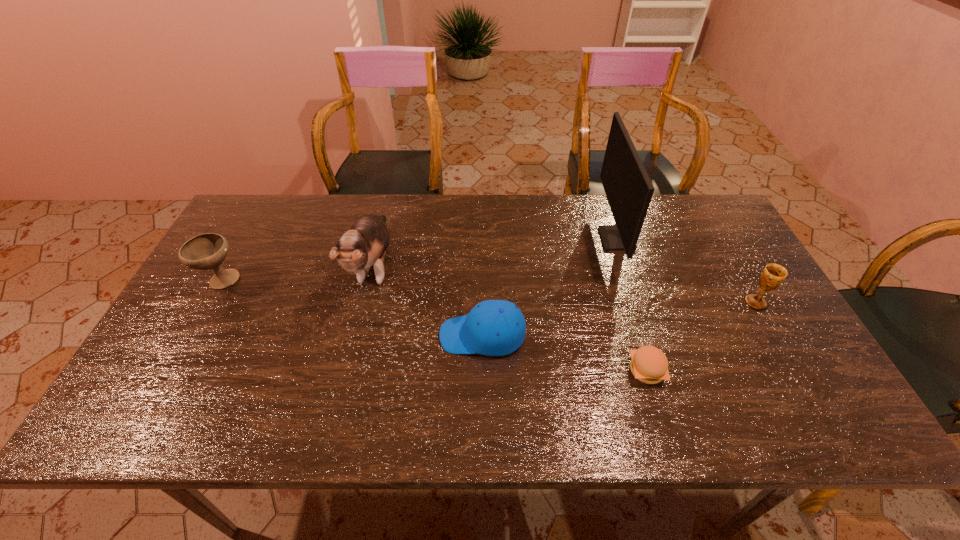
Locate an element on the screen. computer monitor is located at coordinates (628, 188).

Find the location of a particular element. Image resolution: width=960 pixels, height=540 pixels. the fifth object from right to left is located at coordinates (365, 244).

This screenshot has width=960, height=540. In order to click on cat in this screenshot , I will do `click(365, 244)`.

Image resolution: width=960 pixels, height=540 pixels. In order to click on the leftmost object in this screenshot , I will do `click(207, 251)`.

Identify the location of the right chalice. (773, 275).

At what (x,y) coordinates should I click in order to perform the action: click on cap. Please return your answer as a coordinate pair (x, y). This screenshot has height=540, width=960. Looking at the image, I should click on (496, 327).

Image resolution: width=960 pixels, height=540 pixels. What are the coordinates of `the fourth object from right to left` in the screenshot? It's located at (496, 327).

Identify the location of the shortest object. (649, 364).

Identify the location of vacant space located on the front-facing side of the tallest object. Image resolution: width=960 pixels, height=540 pixels. (508, 239).

Find the location of a particular element. The width and height of the screenshot is (960, 540). free space located on the front-facing side of the tallest object is located at coordinates (553, 239).